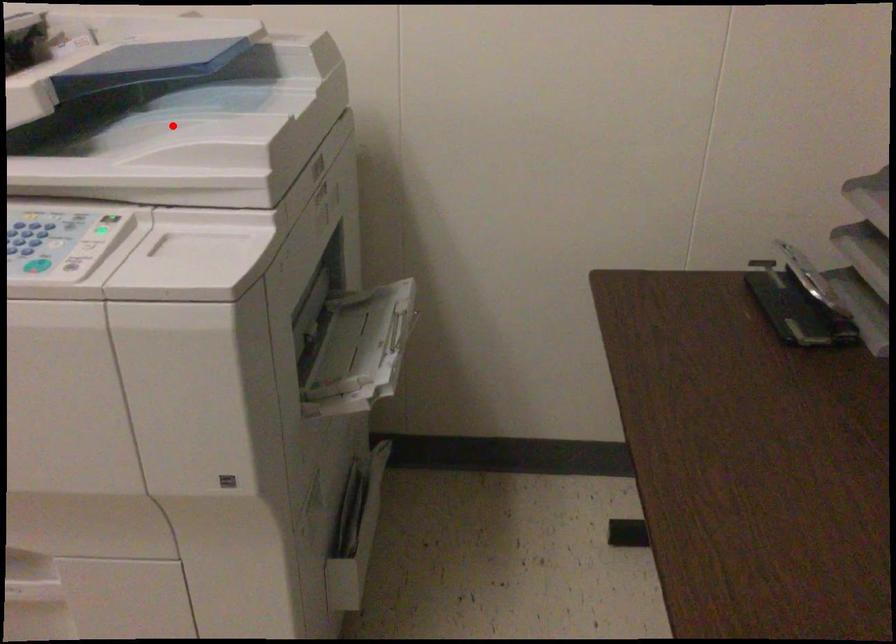
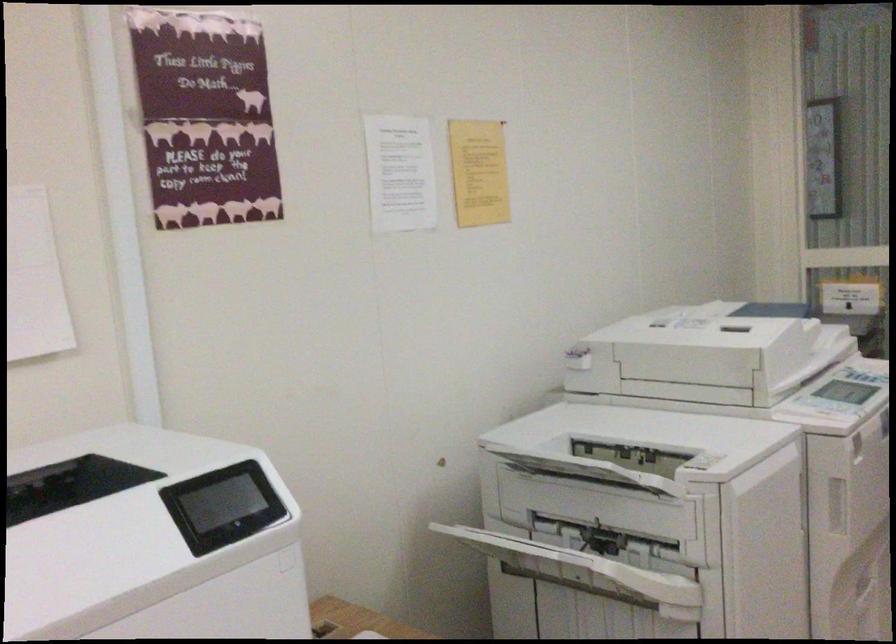
Question: I am providing you with two images of the same scene from different viewpoints. A red point is marked on the first image. Can you still see the location of the red point in image 2?

Choices:
 (A) Yes
 (B) No

Answer: (B)